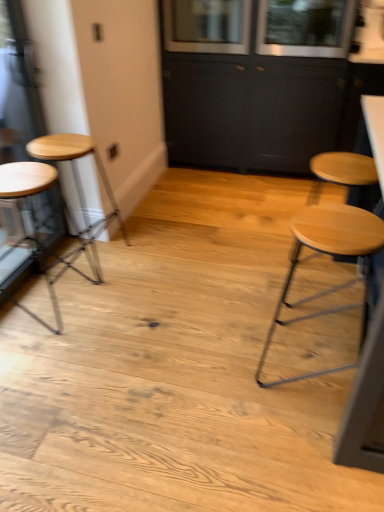
Question: Relative to wooden stool at left, the third stool in the right-to-left sequence, is clear glass window at upper center, placed as the 2th window when sorted from left to right, in front or behind?

Choices:
 (A) behind
 (B) front

Answer: (A)

Question: Is clear glass window at upper center, placed as the 2th window when sorted from left to right, taller or shorter than wooden stool at left, the third stool in the right-to-left sequence?

Choices:
 (A) short
 (B) tall

Answer: (A)

Question: Which object is positioned closest to the light wood stool at right, which appears as the 3th stool when viewed from the left?

Choices:
 (A) wooden stool at left, acting as the 1th stool starting from the left
 (B) clear glass window at upper center, placed as the 2th window when sorted from left to right
 (C) light brown wood stool at left, which appears as the second stool when viewed from the left
 (D) matte black cabinet at upper center
 (E) clear glass window at upper center, which is the 1th window in left-to-right order

Answer: (C)

Question: Considering the real-world distances, which object is farthest from the clear glass window at upper center, arranged as the second window when viewed from the right?

Choices:
 (A) matte black cabinet at upper center
 (B) wooden stool at left, acting as the 1th stool starting from the left
 (C) clear glass window at upper center, placed as the 2th window when sorted from left to right
 (D) light wood stool at right, which appears as the first stool when viewed from the right
 (E) light brown wood stool at left, which appears as the second stool when viewed from the left

Answer: (D)